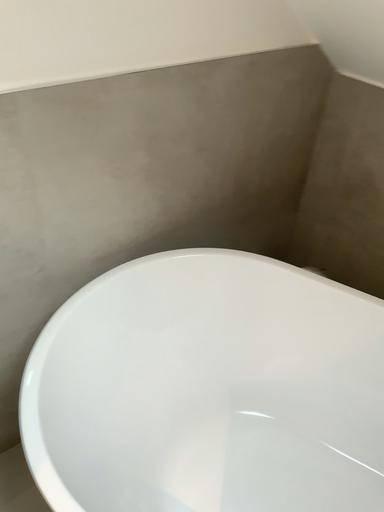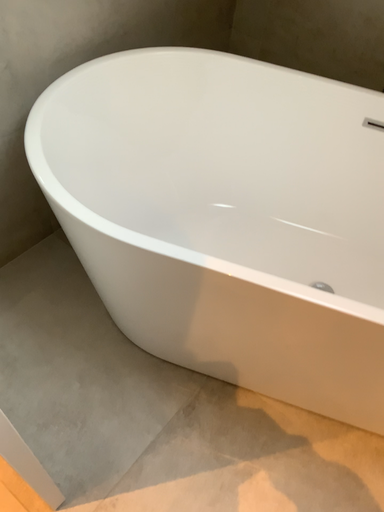
Question: Which way did the camera rotate in the video?

Choices:
 (A) rotated downward
 (B) rotated upward

Answer: (A)